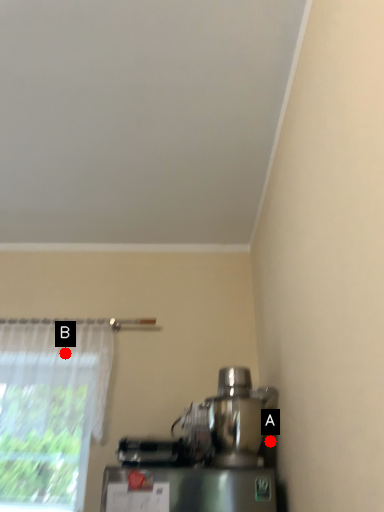
Question: Two points are circled on the image, labeled by A and B beside each circle. Which point is closer to the camera?

Choices:
 (A) A is closer
 (B) B is closer

Answer: (A)